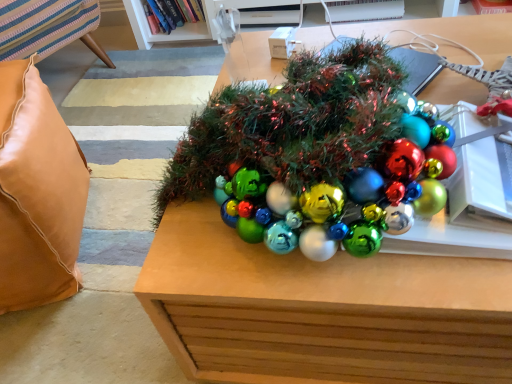
Question: From the image's perspective, is metallic brown table at center, the second table in the top-to-bottom sequence, positioned above or below leather cushion at left?

Choices:
 (A) below
 (B) above

Answer: (B)

Question: Is metallic brown table at center, the second table in the top-to-bottom sequence, inside or outside of leather cushion at left?

Choices:
 (A) outside
 (B) inside

Answer: (A)

Question: Which object is positioned farthest from the shiny green tinsel at center, placed as the 1th table when sorted from top to bottom?

Choices:
 (A) hardcover book at upper center
 (B) leather cushion at left
 (C) metallic brown table at center, positioned as the 1th table in bottom-to-top order

Answer: (A)

Question: Based on their relative distances, which object is farther from the leather cushion at left?

Choices:
 (A) hardcover book at upper center
 (B) metallic brown table at center, positioned as the 1th table in bottom-to-top order
 (C) shiny green tinsel at center, placed as the 1th table when sorted from top to bottom

Answer: (A)